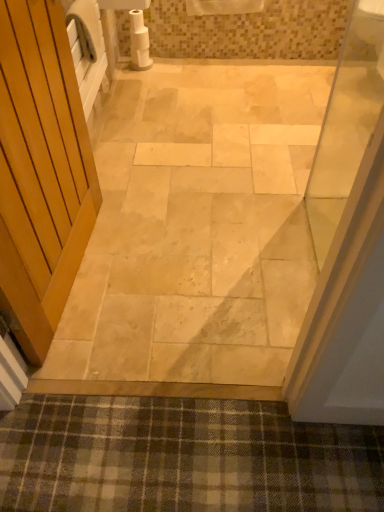
Question: Are natural stone floor at center and white matte toilet paper at upper center beside each other?

Choices:
 (A) no
 (B) yes

Answer: (A)

Question: Considering the relative positions of natural stone floor at center and white matte toilet paper at upper center in the image provided, is natural stone floor at center to the right of white matte toilet paper at upper center from the viewer's perspective?

Choices:
 (A) yes
 (B) no

Answer: (A)

Question: Is natural stone floor at center far away from white matte toilet paper at upper center?

Choices:
 (A) yes
 (B) no

Answer: (A)

Question: Is natural stone floor at center not inside white matte toilet paper at upper center?

Choices:
 (A) yes
 (B) no

Answer: (A)

Question: Considering the relative positions of natural stone floor at center and white matte toilet paper at upper center in the image provided, is natural stone floor at center to the left of white matte toilet paper at upper center from the viewer's perspective?

Choices:
 (A) yes
 (B) no

Answer: (B)

Question: Can you confirm if natural stone floor at center is shorter than white matte toilet paper at upper center?

Choices:
 (A) yes
 (B) no

Answer: (A)

Question: From the image's perspective, is white matte toilet paper at upper center beneath natural stone floor at center?

Choices:
 (A) no
 (B) yes

Answer: (A)

Question: Is white matte toilet paper at upper center positioned with its back to natural stone floor at center?

Choices:
 (A) yes
 (B) no

Answer: (B)

Question: Is white matte toilet paper at upper center directly adjacent to natural stone floor at center?

Choices:
 (A) yes
 (B) no

Answer: (B)

Question: From a real-world perspective, is white matte toilet paper at upper center located beneath natural stone floor at center?

Choices:
 (A) yes
 (B) no

Answer: (B)

Question: From the image's perspective, is white matte toilet paper at upper center on natural stone floor at center?

Choices:
 (A) yes
 (B) no

Answer: (A)

Question: Is white matte toilet paper at upper center aimed at natural stone floor at center?

Choices:
 (A) yes
 (B) no

Answer: (B)

Question: Is natural stone floor at center located within plaid fabric bath mat at lower center?

Choices:
 (A) yes
 (B) no

Answer: (B)